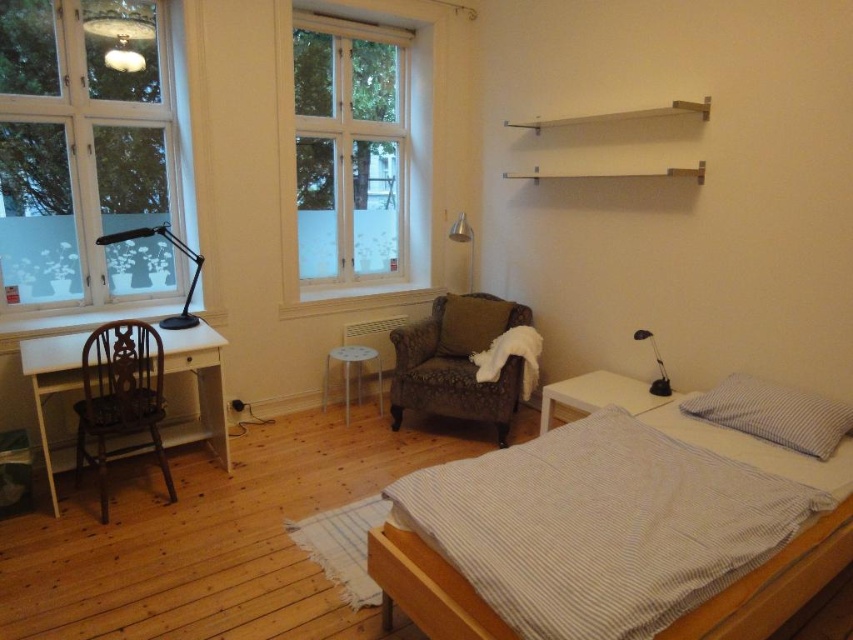
Between clear glass window at upper left and velvet-patterned armchair at center, which one appears on the right side from the viewer's perspective?

Positioned to the right is velvet-patterned armchair at center.

Can you confirm if clear glass window at upper left is positioned above velvet-patterned armchair at center?

Correct, clear glass window at upper left is located above velvet-patterned armchair at center.

Measure the distance between clear glass window at upper left and camera.

clear glass window at upper left is 3.38 meters from camera.

Find the location of `clear glass window at upper left`. clear glass window at upper left is located at coordinates (86, 156).

Is white wood desk at left positioned in front of white checkered pillow at upper right?

No, white wood desk at left is behind white checkered pillow at upper right.

What do you see at coordinates (200, 381) in the screenshot? The width and height of the screenshot is (853, 640). I see `white wood desk at left` at bounding box center [200, 381].

This screenshot has height=640, width=853. I want to click on white wood desk at left, so click(x=200, y=381).

Can you confirm if velvet-patterned armchair at center is positioned to the right of white matte shelf at upper center?

No, velvet-patterned armchair at center is not to the right of white matte shelf at upper center.

Does point (476, 321) come in front of point (679, 100)?

No, it is not.

Identify the location of velvet-patterned armchair at center. pos(456,362).